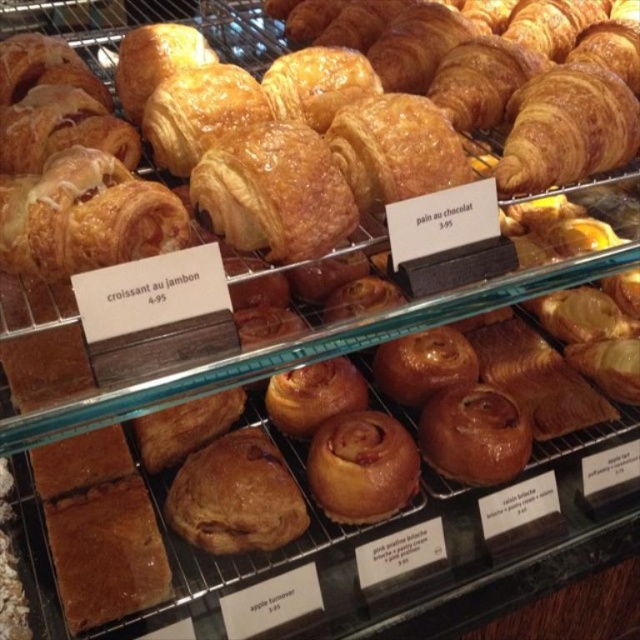
Between point (244, 484) and point (369, 467), which one is positioned in front?

Point (244, 484)

The image size is (640, 640). What do you see at coordinates (236, 497) in the screenshot? I see `golden brown flaky pastry at center` at bounding box center [236, 497].

The image size is (640, 640). Describe the element at coordinates (236, 497) in the screenshot. I see `golden brown flaky pastry at center` at that location.

In order to click on golden brown flaky pastry at center in this screenshot , I will do `click(236, 497)`.

Which is more to the left, golden brown doughnut at center or golden brown flaky croissant at upper center?

golden brown doughnut at center is more to the left.

Between golden brown doughnut at center and golden brown flaky croissant at upper center, which one appears on the right side from the viewer's perspective?

Positioned to the right is golden brown flaky croissant at upper center.

Does point (356, 412) come farther from viewer compared to point (179, 163)?

Yes, it is behind point (179, 163).

Locate an element on the screen. This screenshot has width=640, height=640. golden brown doughnut at center is located at coordinates (362, 467).

Can you confirm if golden brown flaky pastry at center is wider than golden brown flaky croissant at upper center?

Incorrect, golden brown flaky pastry at center's width does not surpass golden brown flaky croissant at upper center's.

Can you confirm if golden brown flaky pastry at center is positioned to the left of golden brown flaky croissant at upper center?

Indeed, golden brown flaky pastry at center is positioned on the left side of golden brown flaky croissant at upper center.

Who is more distant from viewer, (x=260, y=532) or (x=512, y=188)?

Point (x=260, y=532)

This screenshot has height=640, width=640. What are the coordinates of `golden brown flaky pastry at center` in the screenshot? It's located at (236, 497).